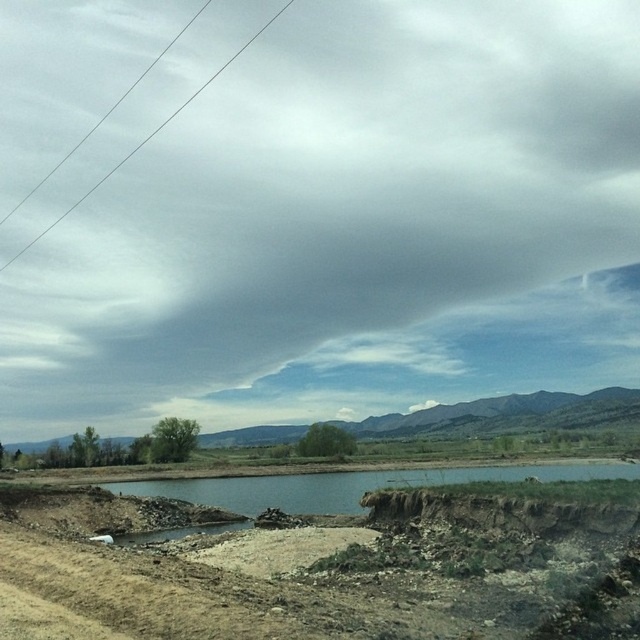
Question: Does smooth wire at upper left appear on the right side of brown dirt puddle at lower center?

Choices:
 (A) no
 (B) yes

Answer: (A)

Question: Which object is the farthest from the smooth wire at upper left?

Choices:
 (A) gray/cloudy sky at upper center
 (B) brown dirt puddle at lower center

Answer: (B)

Question: Can you confirm if gray/cloudy sky at upper center is thinner than smooth wire at upper left?

Choices:
 (A) no
 (B) yes

Answer: (A)

Question: Can you confirm if smooth wire at upper left is smaller than brown dirt puddle at lower center?

Choices:
 (A) no
 (B) yes

Answer: (A)

Question: Which of the following is the closest to the observer?

Choices:
 (A) smooth wire at upper left
 (B) gray/cloudy sky at upper center

Answer: (B)

Question: Which object is positioned closest to the smooth wire at upper left?

Choices:
 (A) gray/cloudy sky at upper center
 (B) brown dirt puddle at lower center

Answer: (A)